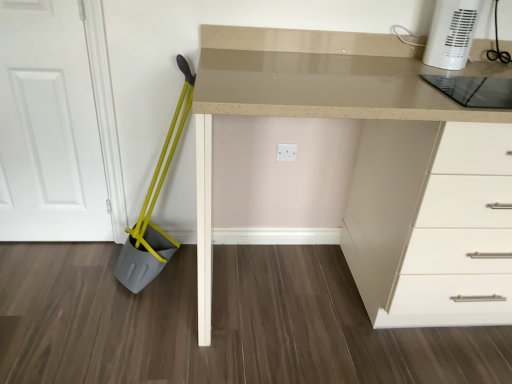
Locate an element on the screen. This screenshot has width=512, height=384. blank space to the left of yellow plastic shovel at left is located at coordinates (82, 274).